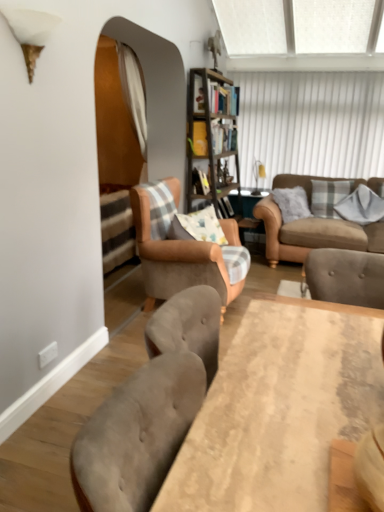
Question: Does wooden table at center appear on the left side of white textured window screen at upper center?

Choices:
 (A) yes
 (B) no

Answer: (A)

Question: Would you say wooden table at center contains white textured window screen at upper center?

Choices:
 (A) yes
 (B) no

Answer: (B)

Question: From a real-world perspective, is wooden table at center positioned over white textured window screen at upper center based on gravity?

Choices:
 (A) no
 (B) yes

Answer: (A)

Question: Is wooden table at center far away from white textured window screen at upper center?

Choices:
 (A) no
 (B) yes

Answer: (B)

Question: Does wooden table at center have a larger size compared to white textured window screen at upper center?

Choices:
 (A) yes
 (B) no

Answer: (B)

Question: Is wooden table at center wider than white textured window screen at upper center?

Choices:
 (A) no
 (B) yes

Answer: (B)

Question: Considering the relative sizes of gray cotton pillow at upper right, which is counted as the second pillow, starting from the left, and wooden table at center in the image provided, is gray cotton pillow at upper right, which is counted as the second pillow, starting from the left, shorter than wooden table at center?

Choices:
 (A) yes
 (B) no

Answer: (A)

Question: Does gray cotton pillow at upper right, which is the first pillow in right-to-left order, have a greater height compared to wooden table at center?

Choices:
 (A) no
 (B) yes

Answer: (A)

Question: Is gray cotton pillow at upper right, which is counted as the second pillow, starting from the left, at the left side of wooden table at center?

Choices:
 (A) yes
 (B) no

Answer: (B)

Question: From the image's perspective, is gray cotton pillow at upper right, which is counted as the second pillow, starting from the left, on wooden table at center?

Choices:
 (A) no
 (B) yes

Answer: (B)

Question: Does gray cotton pillow at upper right, which is the first pillow in right-to-left order, have a larger size compared to wooden table at center?

Choices:
 (A) yes
 (B) no

Answer: (B)

Question: Would you say wooden table at center is part of gray cotton pillow at upper right, which is counted as the second pillow, starting from the left,'s contents?

Choices:
 (A) no
 (B) yes

Answer: (A)

Question: Is the depth of white textured window screen at upper center less than that of wooden table at center?

Choices:
 (A) no
 (B) yes

Answer: (A)